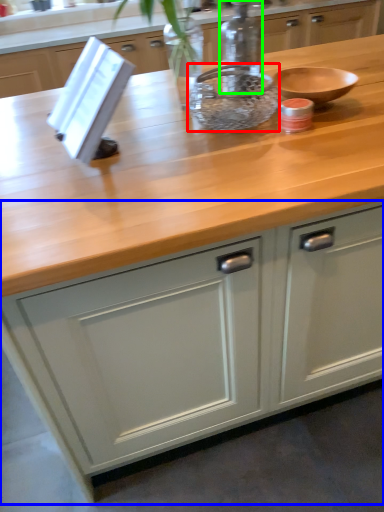
Question: Considering the real-world distances, which object is farthest from bowl (highlighted by a red box)? cabinetry (highlighted by a blue box) or bottle (highlighted by a green box)?

Choices:
 (A) cabinetry
 (B) bottle

Answer: (A)